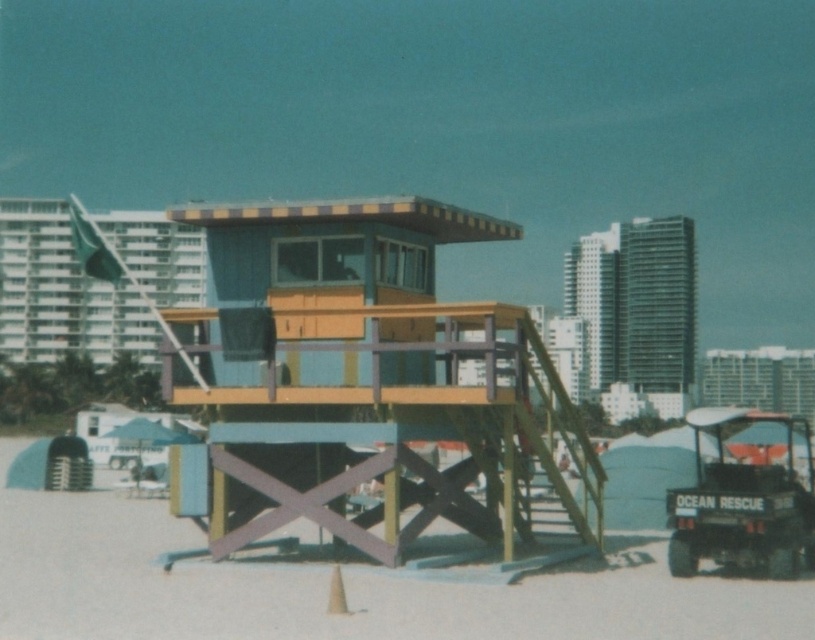
Question: Which point is farther from the camera taking this photo?

Choices:
 (A) (425, 520)
 (B) (369, 634)

Answer: (A)

Question: Which of the following is the closest to the observer?

Choices:
 (A) wooden lifeguard tower at center
 (B) white sand at center

Answer: (B)

Question: Is wooden lifeguard tower at center smaller than white sand at center?

Choices:
 (A) no
 (B) yes

Answer: (A)

Question: Can you confirm if wooden lifeguard tower at center is positioned above white sand at center?

Choices:
 (A) yes
 (B) no

Answer: (A)

Question: Which of the following is the closest to the observer?

Choices:
 (A) (9, 515)
 (B) (593, 483)

Answer: (B)

Question: Can you confirm if wooden lifeguard tower at center is positioned above white sand at center?

Choices:
 (A) no
 (B) yes

Answer: (B)